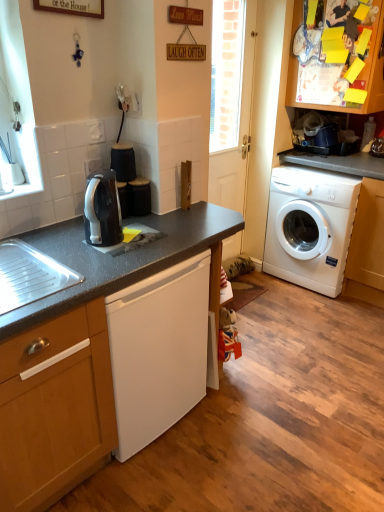
Question: Would you say white glossy door at center is outside black granite countertop at center?

Choices:
 (A) yes
 (B) no

Answer: (A)

Question: From a real-world perspective, does white glossy door at center sit lower than black granite countertop at center?

Choices:
 (A) no
 (B) yes

Answer: (A)

Question: Considering the relative sizes of white glossy door at center and black granite countertop at center in the image provided, is white glossy door at center shorter than black granite countertop at center?

Choices:
 (A) yes
 (B) no

Answer: (B)

Question: From the image's perspective, is white glossy door at center above black granite countertop at center?

Choices:
 (A) no
 (B) yes

Answer: (B)

Question: Can you confirm if white glossy door at center is positioned to the left of black granite countertop at center?

Choices:
 (A) yes
 (B) no

Answer: (B)

Question: Is white glossy door at center taller than black granite countertop at center?

Choices:
 (A) no
 (B) yes

Answer: (B)

Question: Does white plastic washing machine at right have a greater height compared to yellow paper at upper right, the second cabinetry positioned from the left?

Choices:
 (A) yes
 (B) no

Answer: (A)

Question: Would you say yellow paper at upper right, arranged as the 1th cabinetry when viewed from the back, is part of white plastic washing machine at right's contents?

Choices:
 (A) no
 (B) yes

Answer: (A)

Question: Is white plastic washing machine at right in contact with yellow paper at upper right, which is the first cabinetry from top to bottom?

Choices:
 (A) yes
 (B) no

Answer: (B)

Question: From the image's perspective, would you say white plastic washing machine at right is shown under yellow paper at upper right, which is the first cabinetry from top to bottom?

Choices:
 (A) yes
 (B) no

Answer: (A)

Question: Considering the relative positions of white plastic washing machine at right and yellow paper at upper right, the second cabinetry positioned from the left, in the image provided, is white plastic washing machine at right behind yellow paper at upper right, the second cabinetry positioned from the left,?

Choices:
 (A) yes
 (B) no

Answer: (A)

Question: Is white plastic washing machine at right outside yellow paper at upper right, the second cabinetry positioned from the left?

Choices:
 (A) yes
 (B) no

Answer: (A)